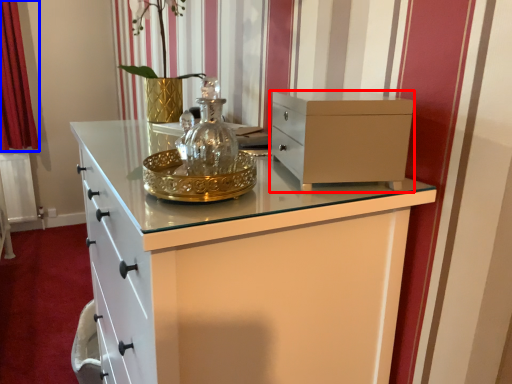
Question: Which point is closer to the camera, chest of drawers (highlighted by a red box) or curtain (highlighted by a blue box)?

Choices:
 (A) chest of drawers
 (B) curtain

Answer: (A)